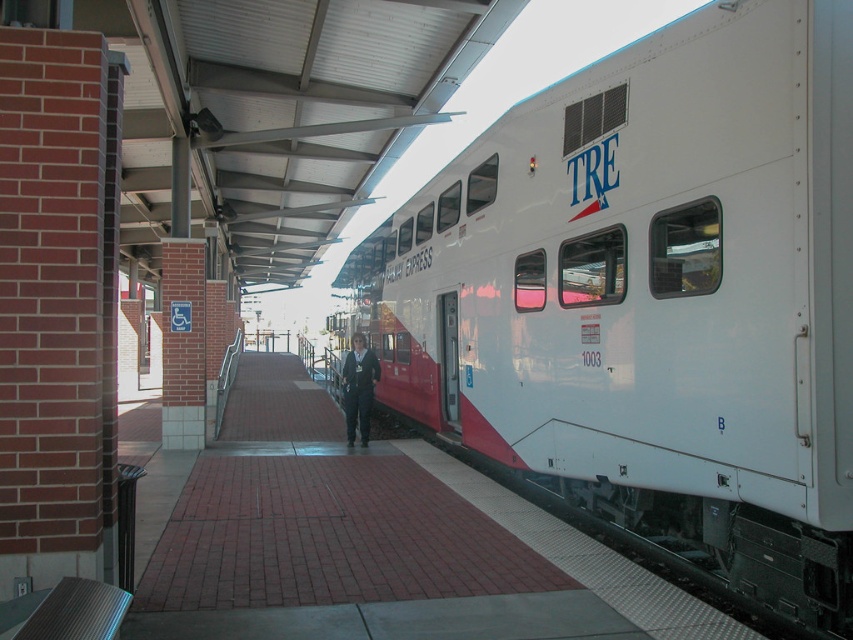
Based on the photo, you are standing on the train station platform and want to board the white glossy train car at center. Based on its position, which direction should you walk to reach it?

The white glossy train car at center is located at point coordinates of (653, 294). Since coordinates are relative to the image frame, you should walk towards the center of the platform to reach it.

You are a passenger waiting at the train station platform. You see the white glossy train car at center and the dark blue fabric jacket at center. If you want to board the train, which object should you move toward and why?

You should move toward the white glossy train car at center because it is the train you need to board. The dark blue fabric jacket at center is 3.70 meters away from the train, so moving toward the train will allow you to board it safely.

In the scene shown: You are a passenger waiting on the platform and want to board the train. You see the white glossy train car at center and the dark blue fabric jacket at center. Which object is closer to you?

The white glossy train car at center is closer to you because it is in front of the dark blue fabric jacket at center.